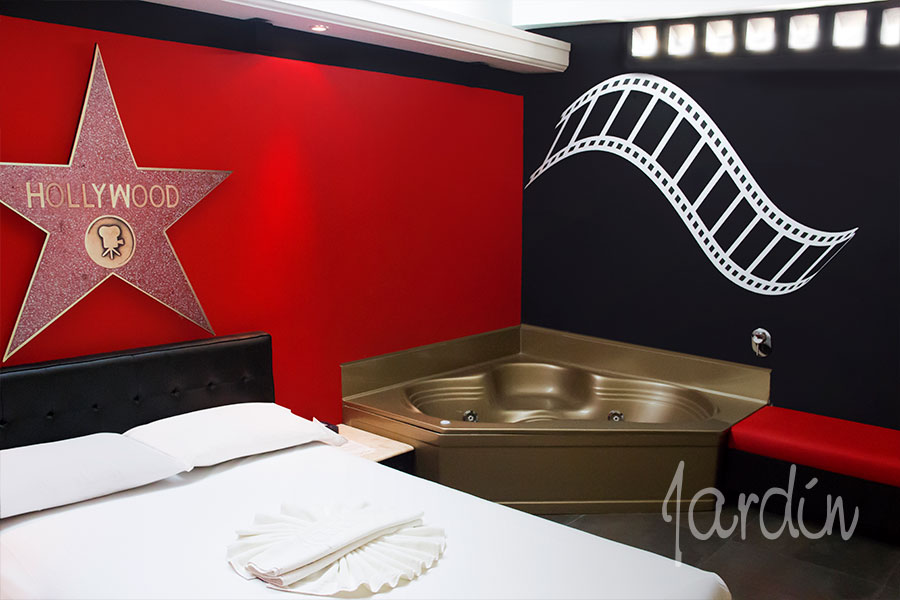
Identify the location of black wall. The image size is (900, 600). (646, 239).